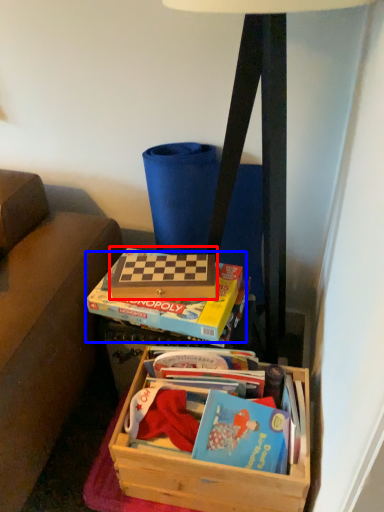
Question: Which of the following is the farthest to the observer, paperback book (highlighted by a red box) or paperback book (highlighted by a blue box)?

Choices:
 (A) paperback book
 (B) paperback book

Answer: (A)